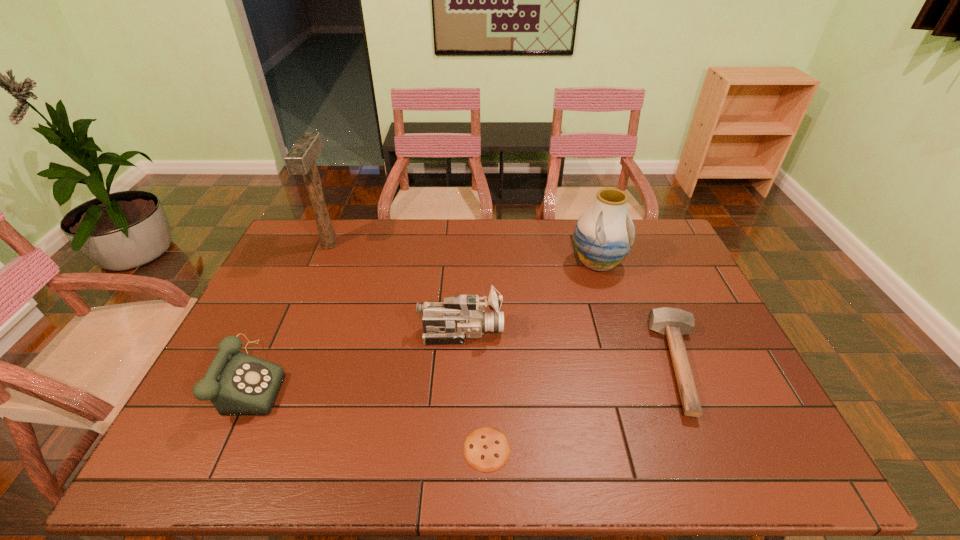
I want to click on the farther mallet, so click(x=300, y=160).

Find the location of a particular element. the taller mallet is located at coordinates (300, 160).

In order to click on vase in this screenshot , I will do `click(604, 234)`.

Find the location of `camcorder`. camcorder is located at coordinates (463, 316).

Where is `telephone`? The width and height of the screenshot is (960, 540). telephone is located at coordinates (236, 383).

The width and height of the screenshot is (960, 540). What are the coordinates of `the shorter mallet` in the screenshot? It's located at pyautogui.click(x=674, y=322).

The width and height of the screenshot is (960, 540). What are the coordinates of `the right mallet` in the screenshot? It's located at (674, 322).

Find the location of a particular element. The height and width of the screenshot is (540, 960). the shortest object is located at coordinates (486, 449).

Locate an element on the screen. Image resolution: width=960 pixels, height=540 pixels. the nearest object is located at coordinates (486, 449).

Locate an element on the screen. This screenshot has height=540, width=960. vacant space situated 0.340m on the right of the left mallet is located at coordinates (433, 245).